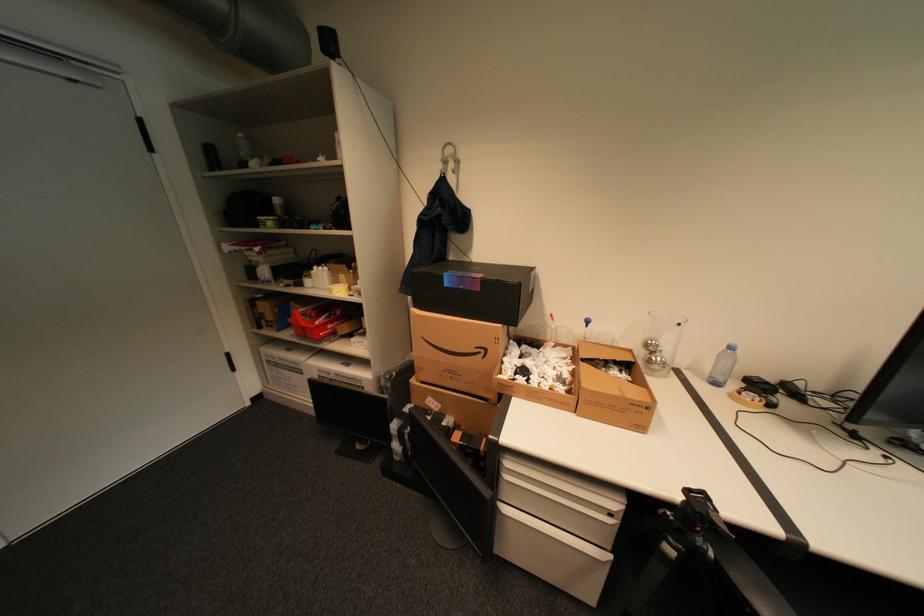
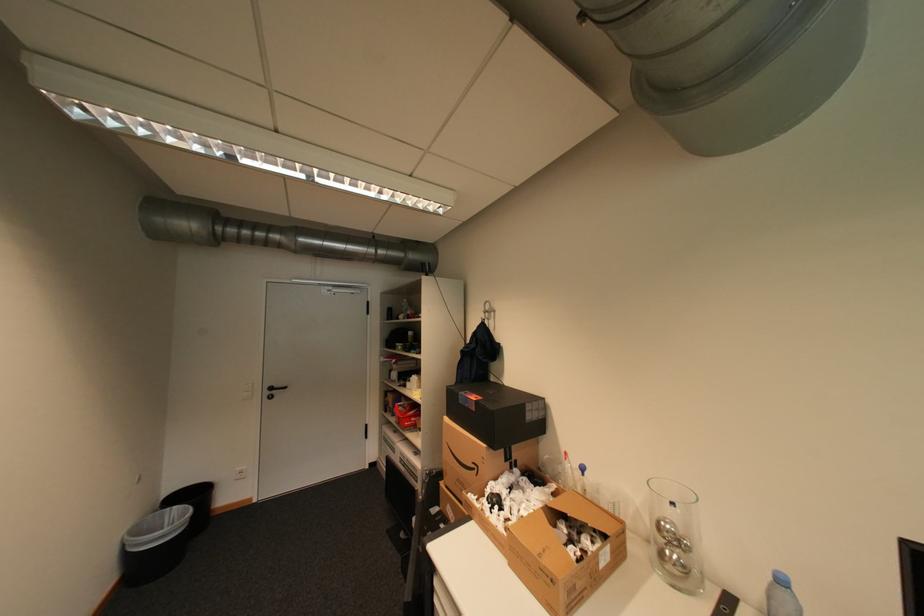
The point at (660, 344) is marked in the first image. Where is the corresponding point in the second image?

(673, 527)